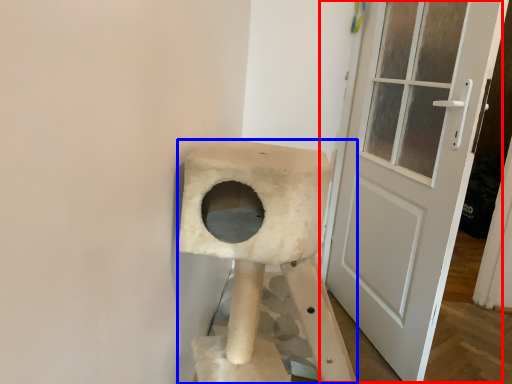
Question: Which point is further to the camera, door (highlighted by a red box) or cat furniture (highlighted by a blue box)?

Choices:
 (A) door
 (B) cat furniture

Answer: (A)